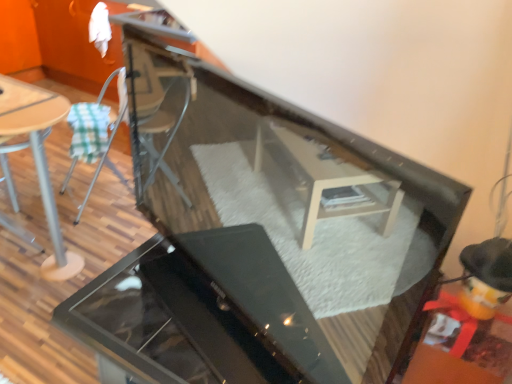
Question: From a real-world perspective, is wooden table at left over metallic silver chair at left?

Choices:
 (A) no
 (B) yes

Answer: (A)

Question: Can you confirm if wooden table at left is positioned to the right of metallic silver chair at left?

Choices:
 (A) yes
 (B) no

Answer: (B)

Question: From the image's perspective, does wooden table at left appear lower than metallic silver chair at left?

Choices:
 (A) yes
 (B) no

Answer: (A)

Question: Does wooden table at left come behind metallic silver chair at left?

Choices:
 (A) no
 (B) yes

Answer: (A)

Question: Is wooden table at left taller than metallic silver chair at left?

Choices:
 (A) no
 (B) yes

Answer: (A)

Question: Is wooden table top at left spatially inside metallic silver chair at left, or outside of it?

Choices:
 (A) outside
 (B) inside

Answer: (A)

Question: Considering their positions, is wooden table top at left located in front of or behind metallic silver chair at left?

Choices:
 (A) front
 (B) behind

Answer: (A)

Question: Based on their positions, is wooden table top at left located to the left or right of metallic silver chair at left?

Choices:
 (A) right
 (B) left

Answer: (B)

Question: Considering the positions of wooden table top at left and metallic silver chair at left in the image, is wooden table top at left bigger or smaller than metallic silver chair at left?

Choices:
 (A) small
 (B) big

Answer: (A)

Question: Considering the positions of point (109, 147) and point (273, 380), is point (109, 147) closer or farther from the camera than point (273, 380)?

Choices:
 (A) farther
 (B) closer

Answer: (A)

Question: From a real-world perspective, is metallic silver chair at left above or below glossy black grill at center?

Choices:
 (A) below
 (B) above

Answer: (B)

Question: In terms of width, does metallic silver chair at left look wider or thinner when compared to glossy black grill at center?

Choices:
 (A) thin
 (B) wide

Answer: (A)

Question: From their relative heights in the image, would you say metallic silver chair at left is taller or shorter than glossy black grill at center?

Choices:
 (A) tall
 (B) short

Answer: (A)

Question: Is metallic silver chair at left wider or thinner than wooden table at left?

Choices:
 (A) wide
 (B) thin

Answer: (A)

Question: Is metallic silver chair at left situated inside wooden table at left or outside?

Choices:
 (A) outside
 (B) inside

Answer: (A)